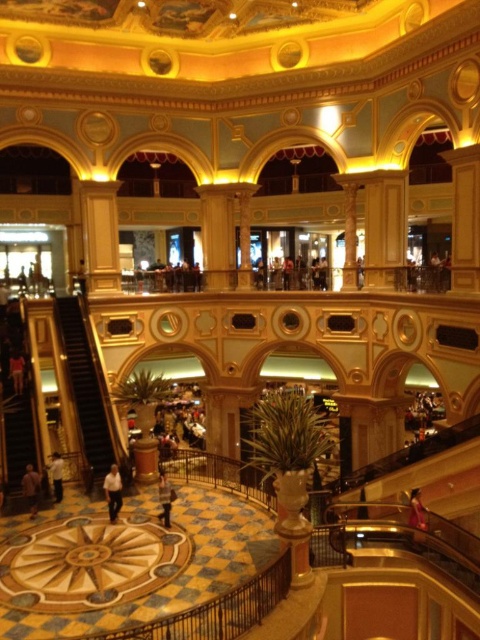
You are a customer in the mall and see the light brown leather jacket at center and the white matte shirt at lower left. Which item is positioned more to the right side of the scene?

The light brown leather jacket at center is positioned to the right of the white matte shirt at lower left, so it is more to the right side of the scene.

You are standing in the grand lobby of the shopping mall and see a pink fabric person at lower right and a white matte shirt at lower left. Which one is nearer to you?

The pink fabric person at lower right is closer to the viewer than the white matte shirt at lower left.